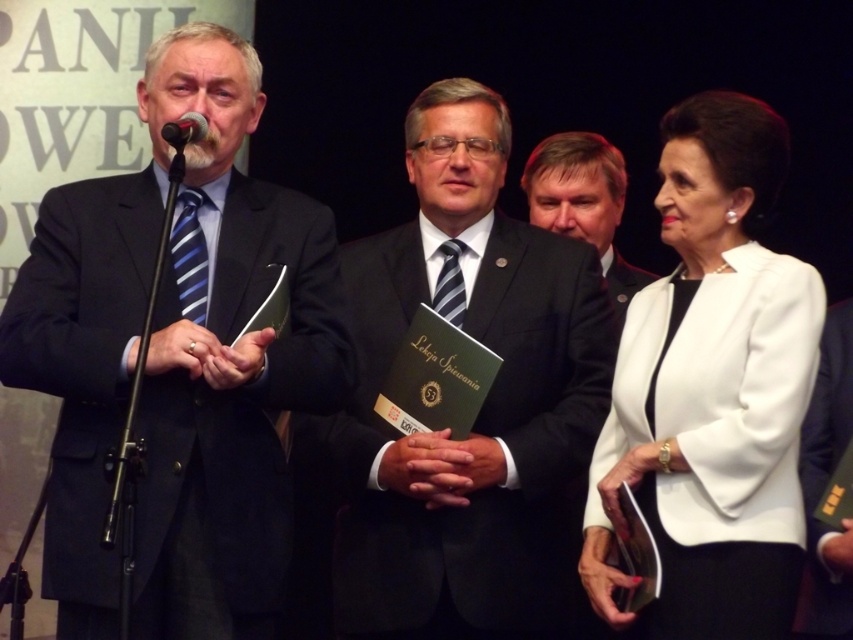
Question: Is matte black suit at center in front of black metallic microphone at upper left?

Choices:
 (A) no
 (B) yes

Answer: (A)

Question: Which point appears farthest from the camera in this image?

Choices:
 (A) (41, 323)
 (B) (437, 557)
 (C) (821, 541)

Answer: (B)

Question: Considering the real-world distances, which object is closest to the matte black suit at left?

Choices:
 (A) matte black suit at center
 (B) black metallic microphone at upper left
 (C) white matte blazer at center
 (D) black satin business suit at center

Answer: (B)

Question: Which of the following is the farthest from the observer?

Choices:
 (A) dark suit at center
 (B) black metallic microphone at upper left
 (C) matte black suit at center

Answer: (A)

Question: Can you confirm if black satin business suit at center is positioned to the right of black metallic microphone at upper left?

Choices:
 (A) yes
 (B) no

Answer: (A)

Question: Is matte black suit at left to the left of dark suit at center from the viewer's perspective?

Choices:
 (A) no
 (B) yes

Answer: (B)